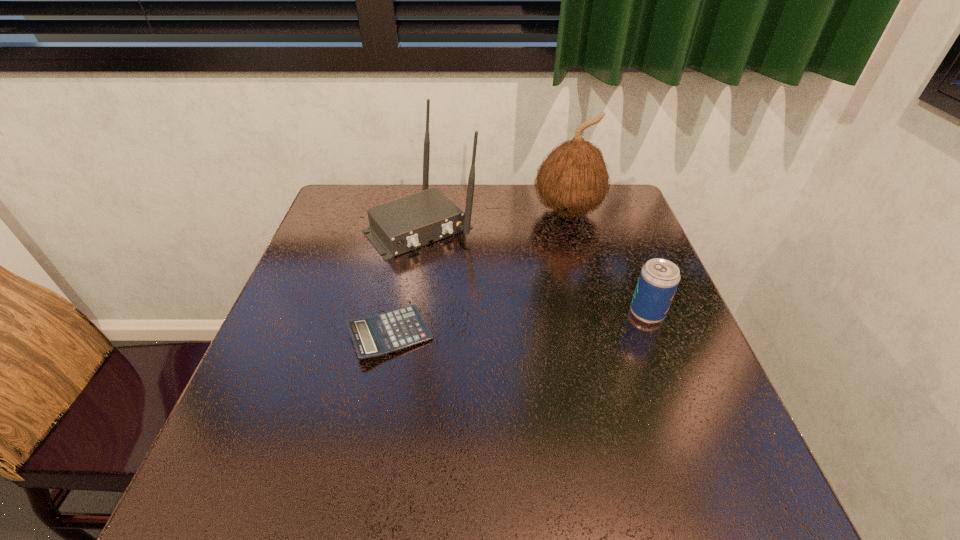
Where is `free spot on the desktop that is between the calculator and the third tallest object and is positioned on the back of the router to connect cables`? The width and height of the screenshot is (960, 540). free spot on the desktop that is between the calculator and the third tallest object and is positioned on the back of the router to connect cables is located at coordinates (513, 325).

Locate an element on the screen. This screenshot has height=540, width=960. free space on the desktop that is between the calculator and the third tallest object and is positioned on the surface of the coconut is located at coordinates (559, 321).